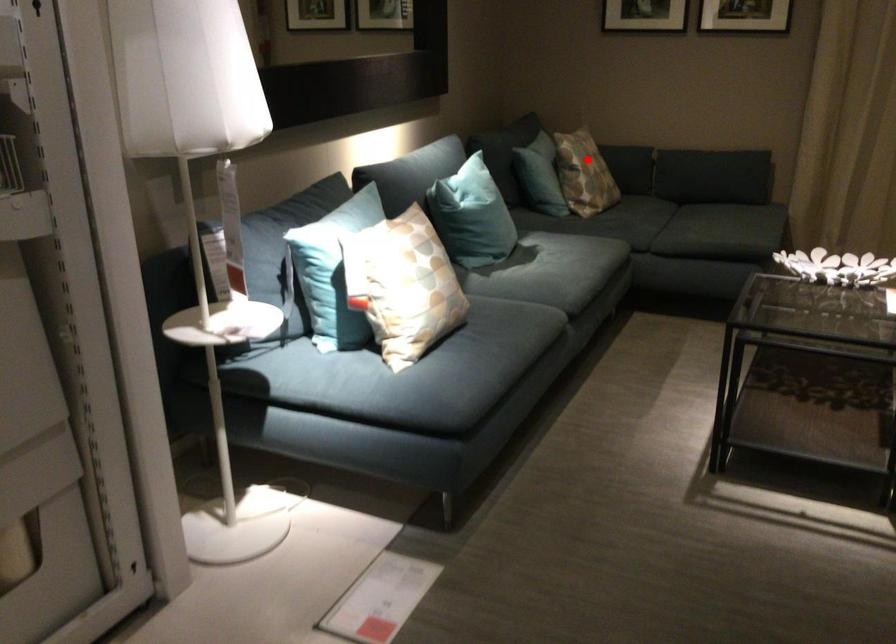
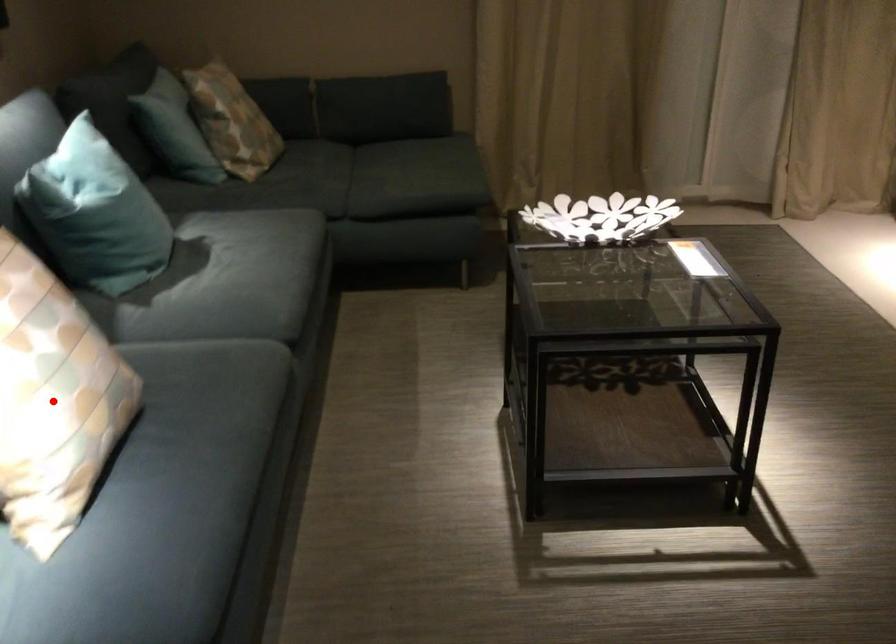
I am providing you with two images of the same scene from different viewpoints. A red point is marked on the first image and another point is marked on the second image. Do the highlighted points in image1 and image2 indicate the same real-world spot?

No